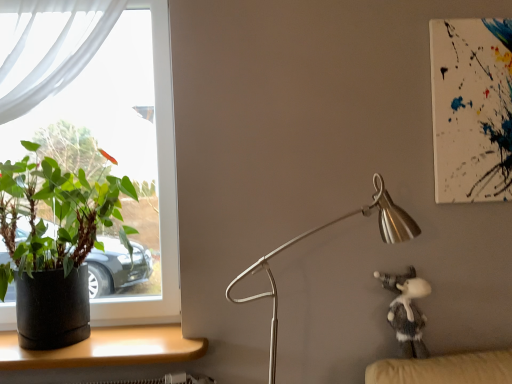
Where is `free point above wooden desk at lower left (from a real-world perspective)`? free point above wooden desk at lower left (from a real-world perspective) is located at coordinates (106, 337).